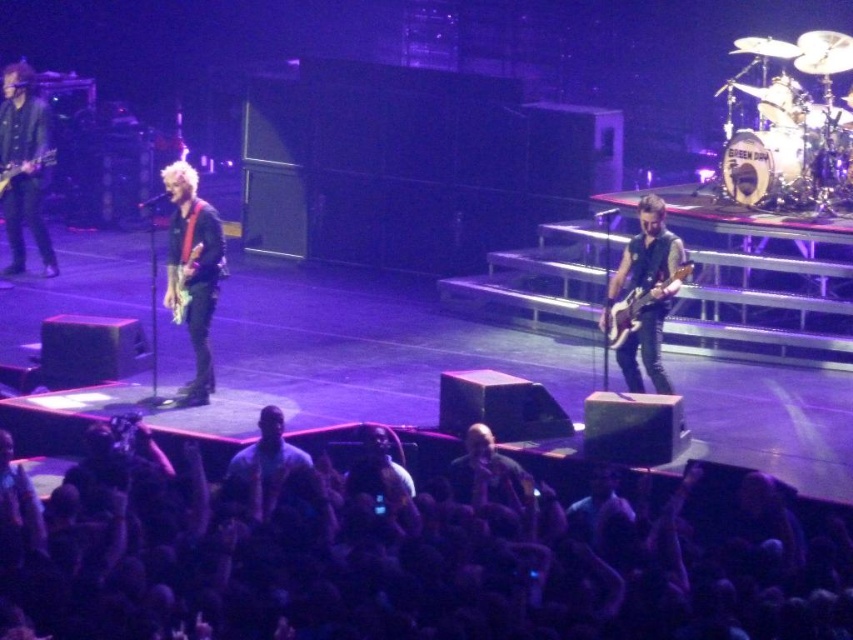
You are a stagehand needing to place a 10 feet long extension cable between the two instruments. Can you fit the cable between the matte black bass at center and the glossy electric guitar at center without bending it?

The matte black bass at center is 11.14 feet from the glossy electric guitar at center, so yes, the 10 feet cable can be placed between them without bending since the distance is sufficient.

You are a photographer at the concert and want to capture a closeup of the matte black bass at center and the matte red electric guitar at left. Which one will appear larger in your photo?

The matte black bass at center will appear larger in the photo because it is closer to the viewer than the matte red electric guitar at left.

You are a stagehand who needs to move the matte black bass at center and the matte red electric guitar at left closer together by 5 feet. Is this possible without moving any other instruments on stage?

The current distance between the matte black bass at center and the matte red electric guitar at left is 22.65 feet. If you reduce this distance by 5 feet, they would be 17.65 feet apart. Since there are no other instruments mentioned in the scene that might obstruct this adjustment, it is possible to move them closer by 5 feet without affecting other equipment.